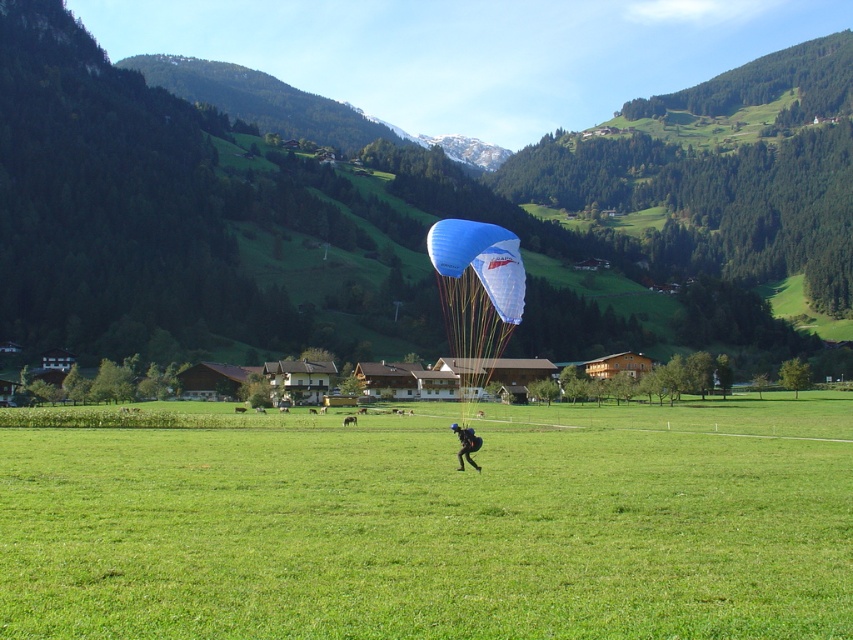
Between green forested mountain at upper center and matte black parachute at center, which one appears on the right side from the viewer's perspective?

matte black parachute at center is more to the right.

Can you confirm if green forested mountain at upper center is taller than matte black parachute at center?

Indeed, green forested mountain at upper center has a greater height compared to matte black parachute at center.

Is point (260, 170) positioned after point (457, 467)?

Yes, point (260, 170) is farther from viewer.

In order to click on green forested mountain at upper center in this screenshot , I will do `click(398, 205)`.

Does point (815, 451) come in front of point (486, 284)?

That is False.

Based on the photo, is green grass field at center thinner than blue fabric parachute at center?

In fact, green grass field at center might be wider than blue fabric parachute at center.

Between point (628, 512) and point (463, 257), which one is positioned behind?

The point (463, 257) is more distant.

I want to click on green grass field at center, so click(437, 525).

Who is positioned more to the right, green forested mountain at upper center or blue fabric parachute at center?

Positioned to the right is blue fabric parachute at center.

In the scene shown: Measure the distance between green forested mountain at upper center and camera.

42.13 meters

Who is more distant from viewer, (738, 188) or (477, 289)?

Point (738, 188)

Locate an element on the screen. Image resolution: width=853 pixels, height=640 pixels. green forested mountain at upper center is located at coordinates (398, 205).